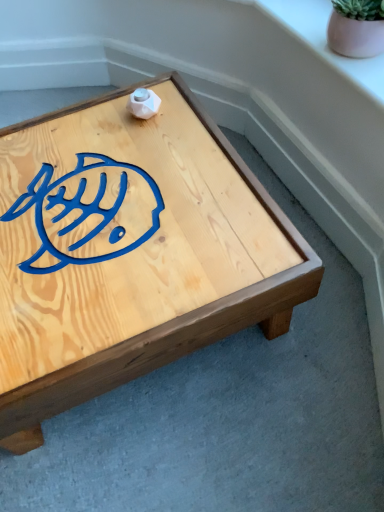
Question: Considering the relative sizes of pink ceramic pot at upper right and natural wood coffee table at center in the image provided, is pink ceramic pot at upper right bigger than natural wood coffee table at center?

Choices:
 (A) yes
 (B) no

Answer: (B)

Question: Is pink ceramic pot at upper right oriented towards natural wood coffee table at center?

Choices:
 (A) no
 (B) yes

Answer: (A)

Question: Would you consider pink ceramic pot at upper right to be distant from natural wood coffee table at center?

Choices:
 (A) yes
 (B) no

Answer: (B)

Question: Is the surface of pink ceramic pot at upper right in direct contact with natural wood coffee table at center?

Choices:
 (A) no
 (B) yes

Answer: (A)

Question: Can you confirm if pink ceramic pot at upper right is positioned to the right of natural wood coffee table at center?

Choices:
 (A) yes
 (B) no

Answer: (A)

Question: From the image's perspective, does pink ceramic pot at upper right appear lower than natural wood coffee table at center?

Choices:
 (A) yes
 (B) no

Answer: (B)

Question: Is the surface of pink ceramic pot at upper right in direct contact with pink matte flowerpot at upper right?

Choices:
 (A) yes
 (B) no

Answer: (A)

Question: Does pink ceramic pot at upper right have a greater height compared to pink matte flowerpot at upper right?

Choices:
 (A) no
 (B) yes

Answer: (A)

Question: Considering the relative positions of pink ceramic pot at upper right and pink matte flowerpot at upper right in the image provided, is pink ceramic pot at upper right behind pink matte flowerpot at upper right?

Choices:
 (A) no
 (B) yes

Answer: (B)

Question: From the image's perspective, does pink ceramic pot at upper right appear higher than pink matte flowerpot at upper right?

Choices:
 (A) yes
 (B) no

Answer: (A)

Question: Considering the relative sizes of pink ceramic pot at upper right and pink matte flowerpot at upper right in the image provided, is pink ceramic pot at upper right bigger than pink matte flowerpot at upper right?

Choices:
 (A) yes
 (B) no

Answer: (A)

Question: Is pink ceramic pot at upper right positioned beyond the bounds of pink matte flowerpot at upper right?

Choices:
 (A) no
 (B) yes

Answer: (B)

Question: Considering the relative sizes of pink matte flowerpot at upper right and pink ceramic pot at upper right in the image provided, is pink matte flowerpot at upper right shorter than pink ceramic pot at upper right?

Choices:
 (A) no
 (B) yes

Answer: (A)